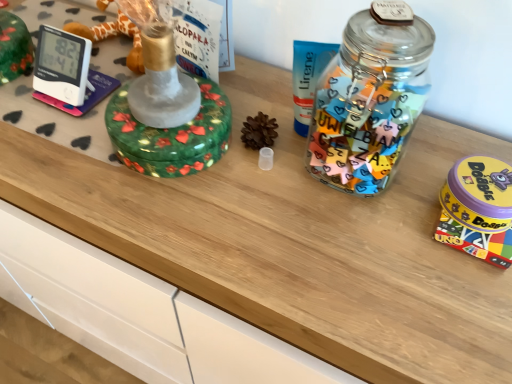
In order to click on unoccupied region to the right of transparent plastic pinecone at center, marked as the 1th toy in a left-to-right arrangement in this screenshot , I will do `click(362, 195)`.